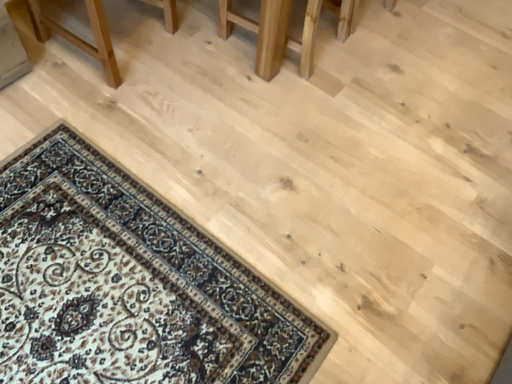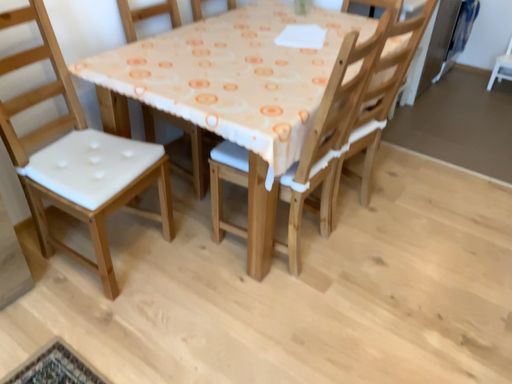
Question: Which way did the camera rotate in the video?

Choices:
 (A) rotated downward
 (B) rotated upward

Answer: (B)